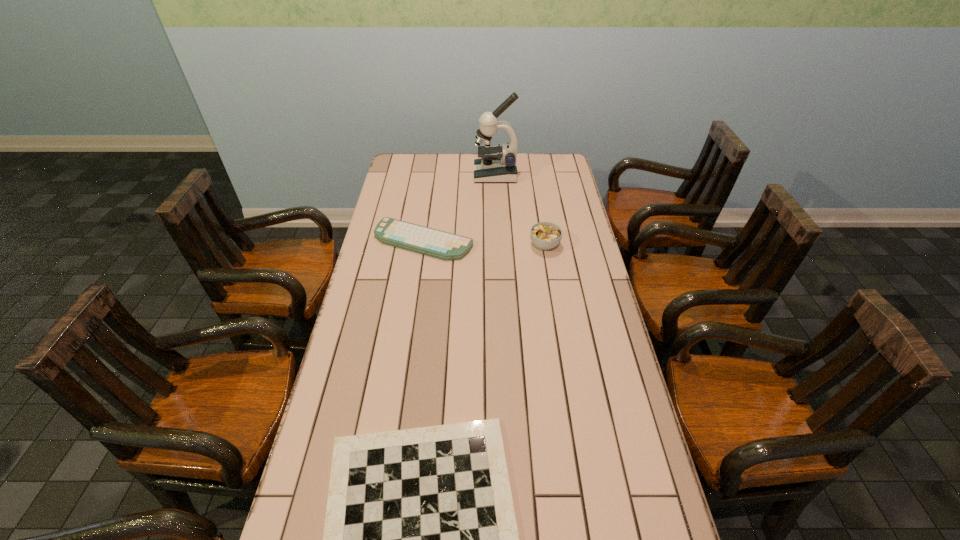
Image resolution: width=960 pixels, height=540 pixels. Identify the location of the farthest object. (497, 163).

Find the location of a particular element. the tallest object is located at coordinates (497, 163).

The image size is (960, 540). Find the location of `the second tallest object`. the second tallest object is located at coordinates (545, 235).

Identify the location of soup bowl. This screenshot has height=540, width=960. (545, 235).

Where is `computer keyboard`? Image resolution: width=960 pixels, height=540 pixels. computer keyboard is located at coordinates (431, 242).

You are a GUI agent. You are given a task and a screenshot of the screen. Output one action in this format:
    pyautogui.click(x=<x>, y=<y>)
    Task: Click on the vacant area located on the front of the tallest object
    
    Given the screenshot: What is the action you would take?
    pyautogui.click(x=496, y=191)

You are a GUI agent. You are given a task and a screenshot of the screen. Output one action in this format:
    pyautogui.click(x=<x>, y=<y>)
    Task: Click on the free region located 0.090m on the right of the soup bowl
    This screenshot has width=960, height=540.
    Given the screenshot: What is the action you would take?
    pyautogui.click(x=584, y=245)

Image resolution: width=960 pixels, height=540 pixels. In order to click on blank space located on the front of the second shortest object in this screenshot , I will do `click(413, 313)`.

Find the location of a particular element. object that is at the far edge is located at coordinates (497, 163).

Identify the location of object that is at the left edge. (431, 242).